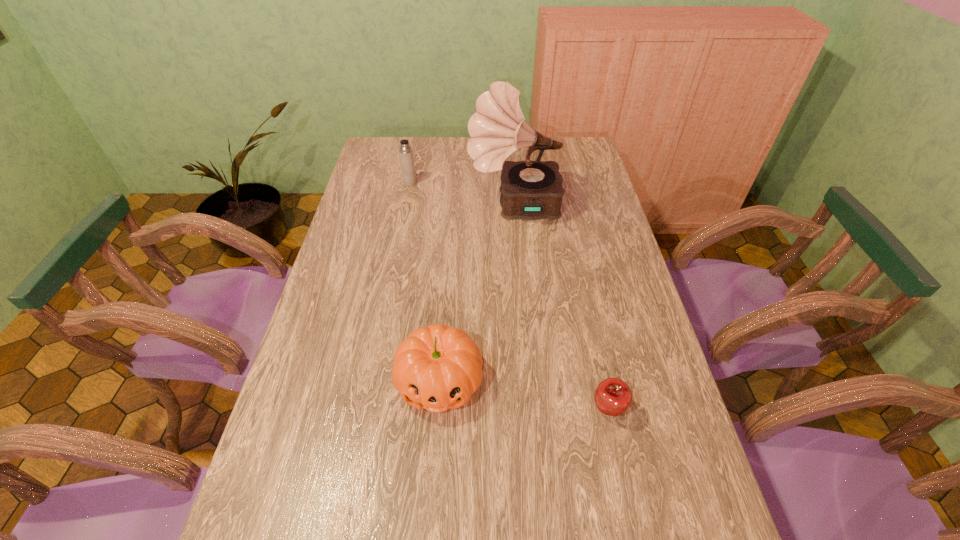
Identify the location of vacant space that satisfies the following two spatial constraints: 1. from the horn of the tallest object; 2. on the carved face of the pumpkin. The image size is (960, 540). (530, 380).